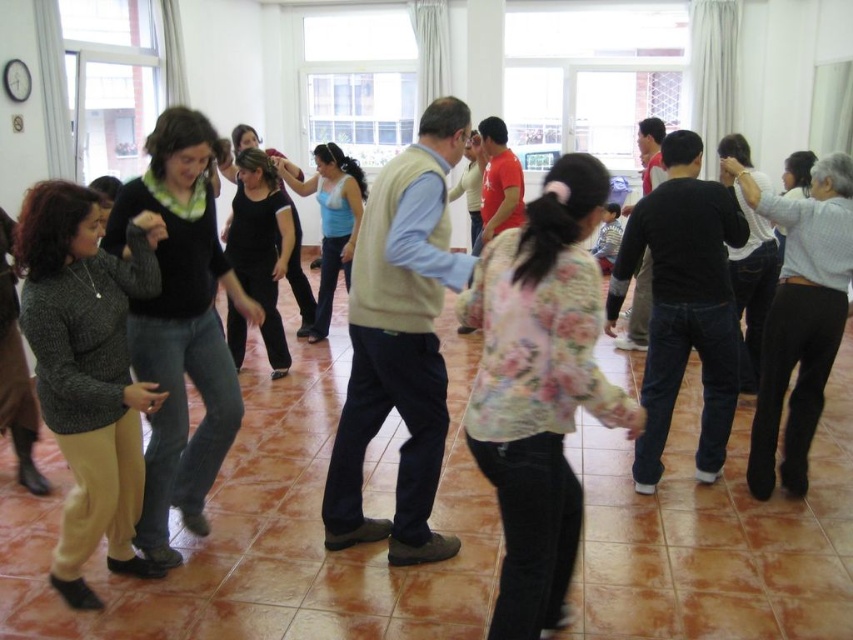
Based on the photo, you are standing at the entrance of the room and want to locate the matte black sweater at center. According to the coordinate system where the bottom left corner is the origin, can you determine if the sweater is closer to the left or right side of the room?

The position of matte black sweater at center is at point (181, 326). Since the x coordinate is 0.512, which is just over halfway to the right side of the room, the sweater is closer to the right side of the room.

In the scene shown: You are a photographer positioned at the entrance of the room. You need to capture a photo that includes both the floral print blouse at center and the knitted gray sweater at left. Based on their positions, which one should you adjust your camera angle to focus on first to ensure both are in frame?

The floral print blouse at center is to the right of the knitted gray sweater at left. To include both in the frame, you should focus on the knitted gray sweater at left first, as it is positioned further left, and then adjust the angle to include the floral print blouse at center which is to its right.

You are a photographer setting up a shoot in this dance class. You need to place a 10cm thick equipment box between the knitted gray sweater at left and the light blue jersey at center. Can the box fit between them based on their thickness?

The knitted gray sweater at left is thinner than the light blue jersey at center, so the 10cm thick equipment box may not fit between them if the space between their thickness is less than 10cm. However, without exact measurements of the space between them, it is uncertain.